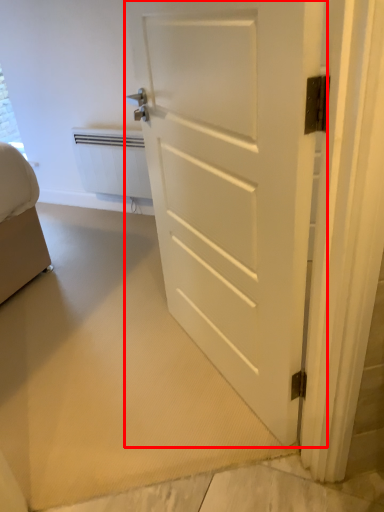
Question: Observing the image, what is the correct spatial positioning of door (annotated by the red box) in reference to radiator?

Choices:
 (A) left
 (B) right

Answer: (B)